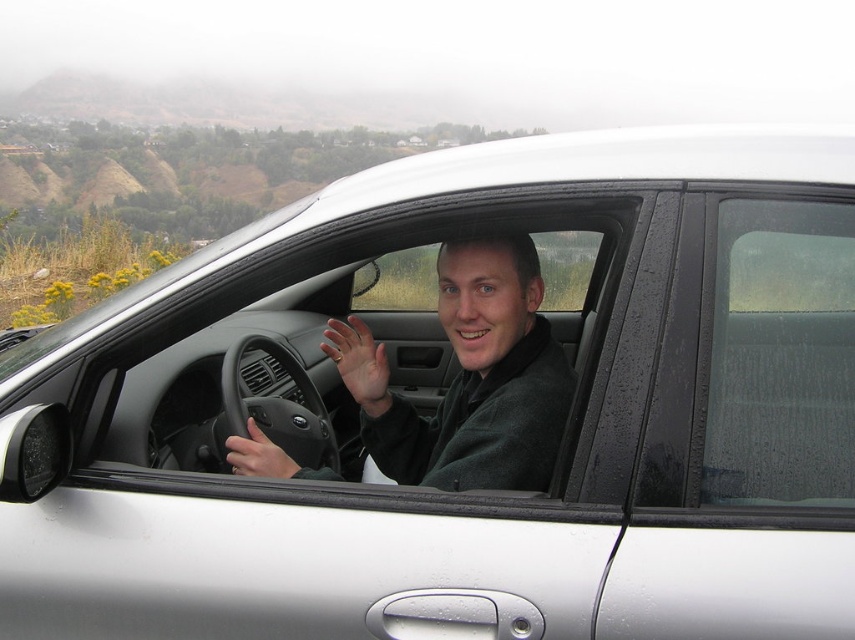
You are a delivery person who needs to place a small package between the wet glass window at center right and the dark gray fleece jacket at center. Can you fit the package there if it measures 24 inches in length?

The distance between the wet glass window at center right and dark gray fleece jacket at center is 24.21 inches, so the 24 inch package can fit between them since it is slightly shorter than the available space.

You are a passenger in the silver car and want to look outside through the window. Is the wet glass window at center right clear enough to see the hilly landscape outside?

The wet glass window at center right is located at point [781,356], but the description does not mention its clarity or whether it is obstructed by water or other elements. Therefore, it is unclear if it is clear enough to see the hilly landscape outside.